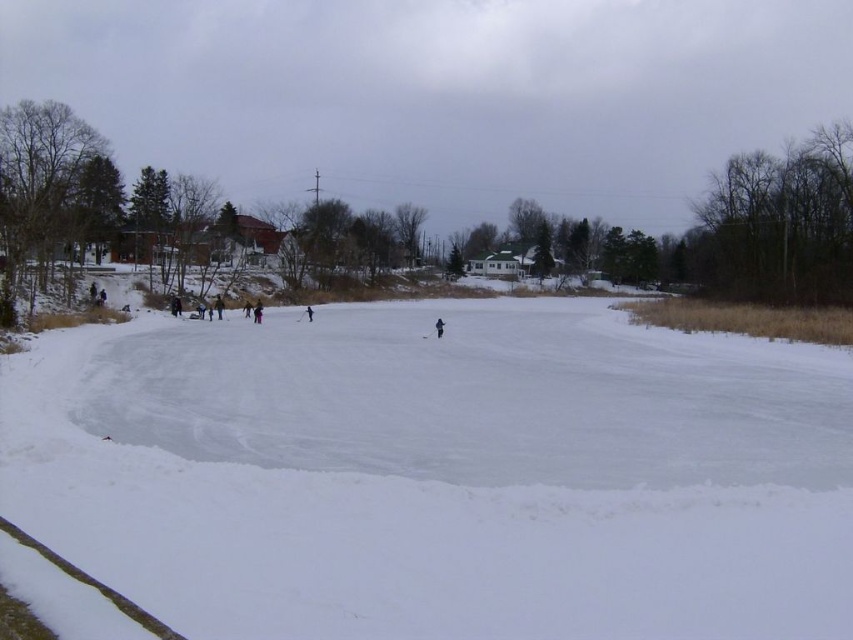
Question: Which of the following is the farthest from the observer?

Choices:
 (A) black matte skier at center
 (B) black snowsuit at center
 (C) dark blue jacket at center

Answer: (C)

Question: Is black snowsuit at center above black matte skier at center?

Choices:
 (A) no
 (B) yes

Answer: (B)

Question: Which point is closer to the camera?

Choices:
 (A) black snowsuit at center
 (B) dark blue jacket at center
 (C) black matte skier at center

Answer: (C)

Question: From the image, what is the correct spatial relationship of dark blue jacket at center in relation to black snowsuit at center?

Choices:
 (A) right
 (B) left

Answer: (B)

Question: Is dark blue jacket at center to the left of black snowsuit at center from the viewer's perspective?

Choices:
 (A) yes
 (B) no

Answer: (A)

Question: Which point is closer to the camera?

Choices:
 (A) black snowsuit at center
 (B) black matte skier at center
 (C) dark blue jacket at center

Answer: (B)